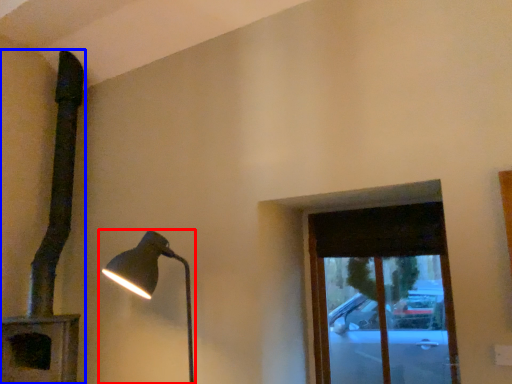
Question: Which object is further to the camera taking this photo, lamp (highlighted by a red box) or lamp (highlighted by a blue box)?

Choices:
 (A) lamp
 (B) lamp

Answer: (B)